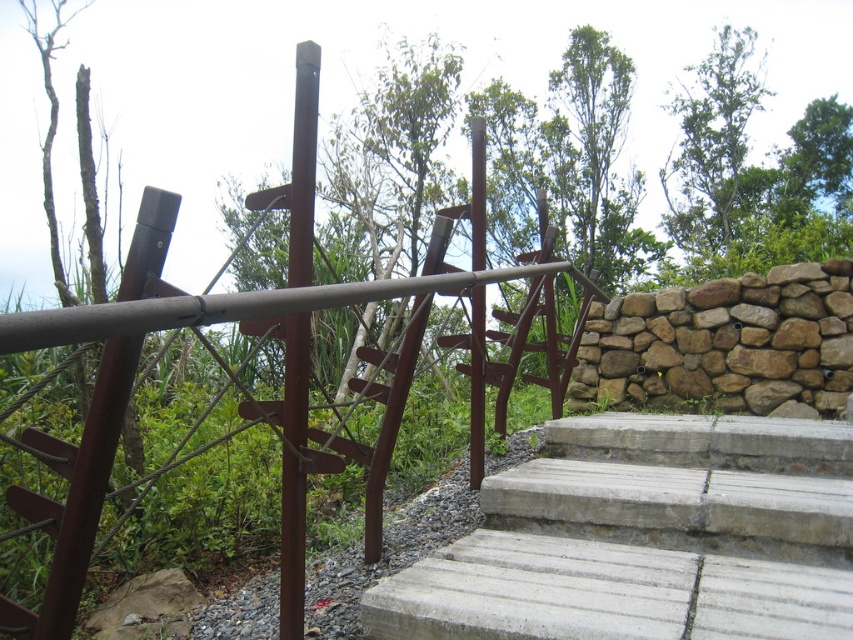
From the picture: You are standing at the base of the steps looking up at the wooden bridge. There are two points marked on the bridge structure. One is at coordinates point (744, 436) and the other at point (476, 337). Which point is closer to you?

Point (476, 337) is closer to you because it is in front of point (744, 436).